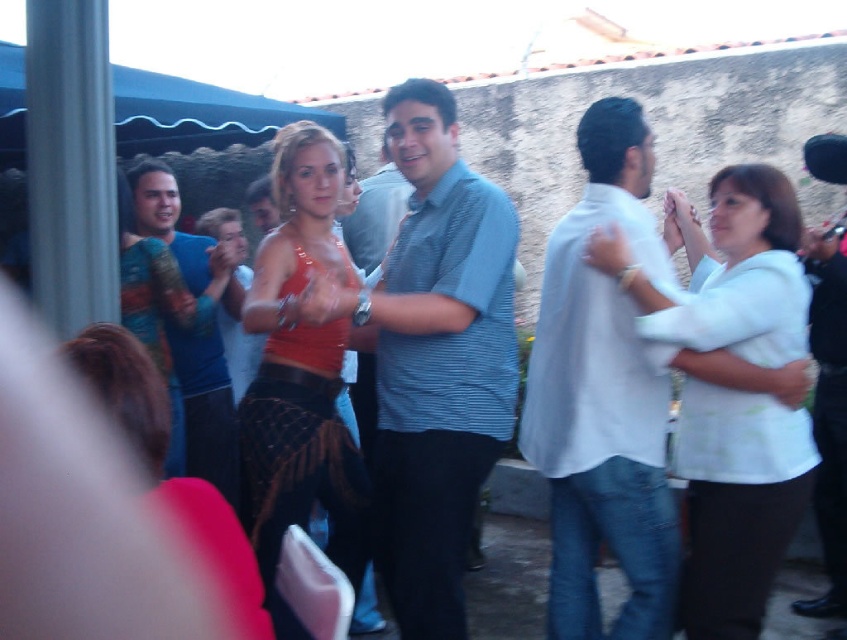
Between white matte shirt at right and matte orange tank top at center, which one has less height?

With less height is white matte shirt at right.

Which of these two, white matte shirt at right or matte orange tank top at center, stands taller?

Standing taller between the two is matte orange tank top at center.

Does point (698, 621) come in front of point (333, 497)?

Yes, it is in front of point (333, 497).

The image size is (847, 640). In order to click on white matte shirt at right in this screenshot , I will do `click(737, 502)`.

From the picture: Measure the distance between white matte shirt at right and blue textured shirt at left.

They are 6.23 feet apart.

The height and width of the screenshot is (640, 847). What are the coordinates of `white matte shirt at right` in the screenshot? It's located at (737, 502).

Identify the location of white matte shirt at right. The image size is (847, 640). (737, 502).

Does white cotton shirt at center have a larger size compared to matte orange tank top at center?

Actually, white cotton shirt at center might be smaller than matte orange tank top at center.

Is white cotton shirt at center wider than matte orange tank top at center?

Yes, white cotton shirt at center is wider than matte orange tank top at center.

Is point (645, 410) closer to viewer compared to point (297, 195)?

That is True.

Where is `white cotton shirt at center`? white cotton shirt at center is located at coordinates (604, 396).